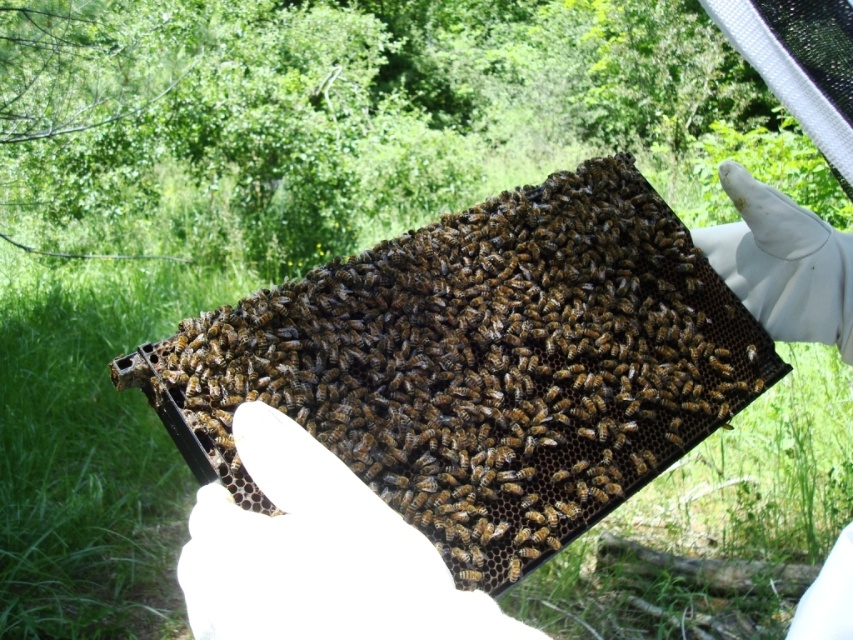
You are a beekeeper trying to inspect a beehive frame. You notice the white glove at center and the brown fuzzy bee at center. Which object is closer to your eyes?

The white glove at center is closer to your eyes because it is in front of the brown fuzzy bee at center.

You are a beekeeper trying to place a marker between the brown matte honeycomb at center and the white glove at center to monitor the hive. Can you fit the marker in the space between them?

The brown matte honeycomb at center and white glove at center are 14.05 inches apart from each other. If the marker is smaller than 14.05 inches, it can fit between them.